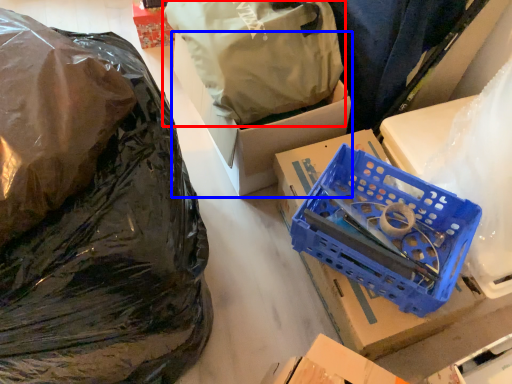
Question: Among these objects, which one is farthest to the camera, plastic bag (highlighted by a red box) or box (highlighted by a blue box)?

Choices:
 (A) plastic bag
 (B) box

Answer: (B)